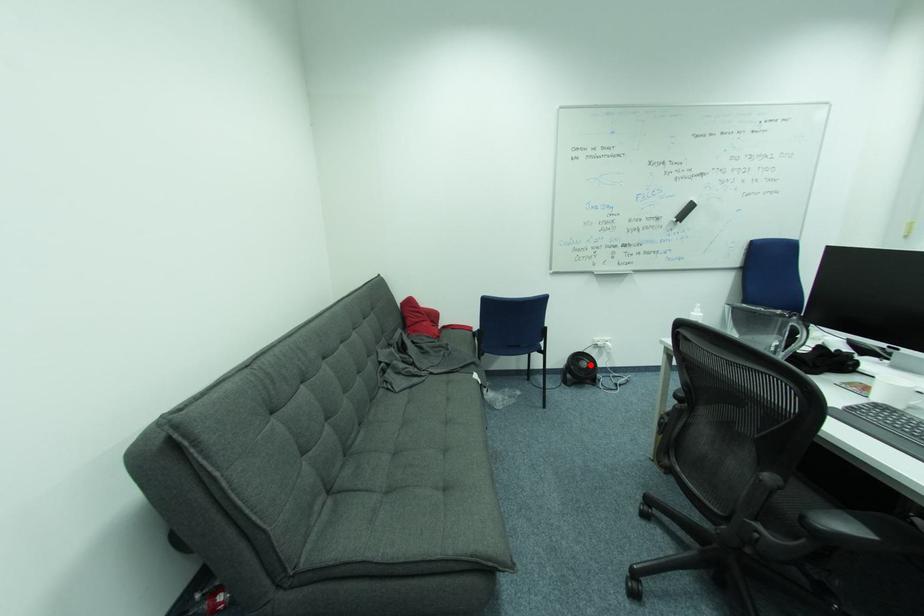
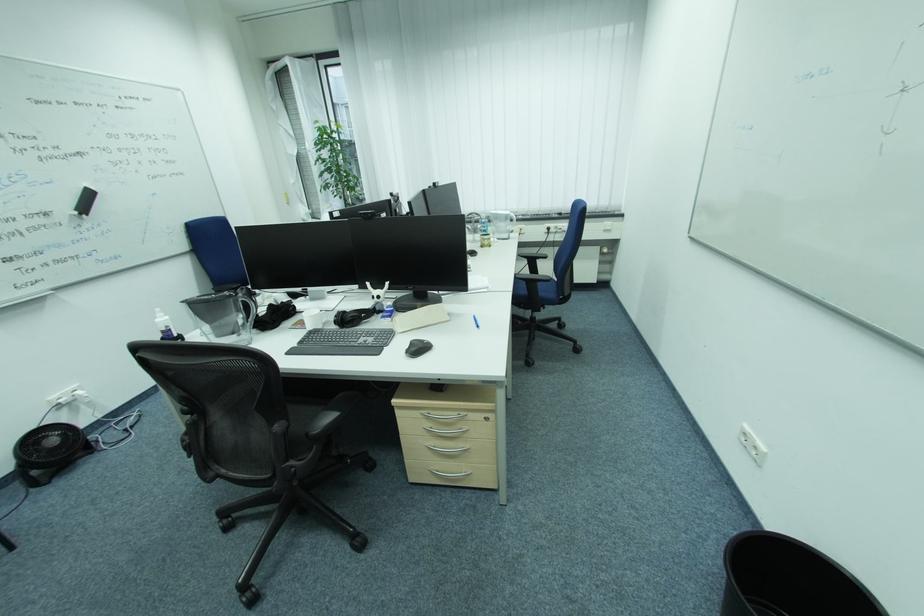
Question: A red point is marked in image1. In image2, is the corresponding 3D point closer to the camera or farther? Reply with the corresponding letter.

Choices:
 (A) The corresponding 3D point is closer.
 (B) The corresponding 3D point is farther.

Answer: (B)